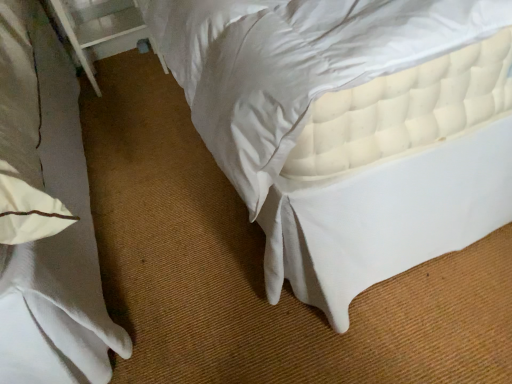
The width and height of the screenshot is (512, 384). What are the coordinates of `free point below white plastic balustrade at upper left (from a real-world perspective)` in the screenshot? It's located at (126, 71).